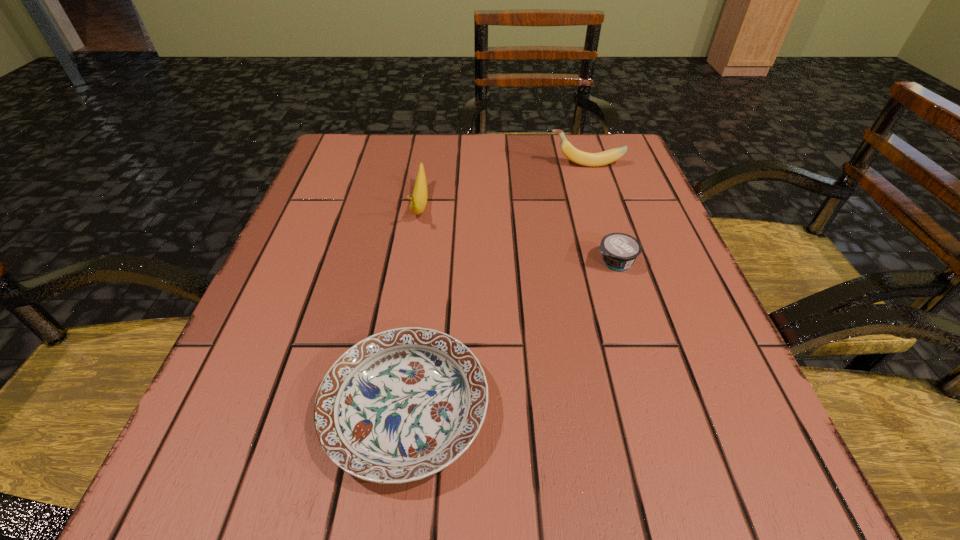
Identify the location of free space at the right edge of the desktop. Image resolution: width=960 pixels, height=540 pixels. (605, 192).

The image size is (960, 540). In the image, there is a desktop. Find the location of `vacant space at the far left corner`. vacant space at the far left corner is located at coordinates (357, 144).

Locate an element on the screen. Image resolution: width=960 pixels, height=540 pixels. vacant area at the near left corner of the desktop is located at coordinates (156, 513).

This screenshot has width=960, height=540. Find the location of `vacant space at the far right corner`. vacant space at the far right corner is located at coordinates (586, 143).

In the image, there is a desktop. Identify the location of blank space at the near right corner. The height and width of the screenshot is (540, 960). pyautogui.click(x=805, y=514).

At what (x,y) coordinates should I click in order to perform the action: click on empty location between the plate and the second farthest object. Please return your answer as a coordinate pair (x, y). The image size is (960, 540). Looking at the image, I should click on (413, 308).

Where is `free area in between the third farthest object and the nearer banana`? free area in between the third farthest object and the nearer banana is located at coordinates (517, 234).

I want to click on free spot between the yogurt and the nearer banana, so click(517, 234).

The height and width of the screenshot is (540, 960). What are the coordinates of `free space that is in between the second nearest object and the left banana` in the screenshot? It's located at (517, 234).

Image resolution: width=960 pixels, height=540 pixels. What are the coordinates of `free space between the nearest object and the second farthest object` in the screenshot? It's located at (413, 308).